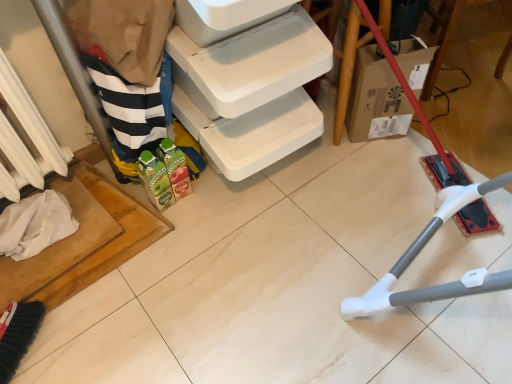
In order to face cardboard box at lower right, should I rotate leftwards or rightwards?

It's best to rotate right around 25.082 degrees.

What do you see at coordinates (29, 137) in the screenshot?
I see `white painted metal radiator at left` at bounding box center [29, 137].

The height and width of the screenshot is (384, 512). What are the coordinates of `cardboard box at lower right` in the screenshot? It's located at point(345,58).

Looking at this image, is cardboard box at lower right touching white painted metal radiator at left?

No, cardboard box at lower right is not in contact with white painted metal radiator at left.

Can you confirm if cardboard box at lower right is bigger than white painted metal radiator at left?

Yes.

From the image's perspective, would you say cardboard box at lower right is positioned over white painted metal radiator at left?

Yes, from the image's perspective, cardboard box at lower right is on top of white painted metal radiator at left.

Considering the sizes of objects cardboard box at lower right and white painted metal radiator at left in the image provided, who is wider, cardboard box at lower right or white painted metal radiator at left?

cardboard box at lower right is wider.

Who is smaller, white plastic shelf at lower left or white painted metal radiator at left?

With smaller size is white painted metal radiator at left.

Does white plastic shelf at lower left have a lesser width compared to white painted metal radiator at left?

No.

From a real-world perspective, is white plastic shelf at lower left physically below white painted metal radiator at left?

Yes, from a real-world perspective, white plastic shelf at lower left is under white painted metal radiator at left.

This screenshot has height=384, width=512. In the image, there is a cardboard box at lower right. What are the coordinates of `radiator below it (from the image's perspective)` in the screenshot? It's located at (29, 137).

Which of these two, white painted metal radiator at left or cardboard box at lower right, stands taller?

Standing taller between the two is white painted metal radiator at left.

Can you tell me how much white painted metal radiator at left and cardboard box at lower right differ in facing direction?

The facing directions of white painted metal radiator at left and cardboard box at lower right are 1.82 degrees apart.

Is white painted metal radiator at left at the left side of cardboard box at lower right?

Correct, you'll find white painted metal radiator at left to the left of cardboard box at lower right.

Identify the location of shelf that appears above the cardboard box at lower right (from a real-world perspective). The height and width of the screenshot is (384, 512). (250, 91).

Can you confirm if cardboard box at lower right is thinner than white plastic shelf at lower left?

Yes, cardboard box at lower right is thinner than white plastic shelf at lower left.

Is point (388, 3) positioned behind point (188, 113)?

That is True.

Which of these two, cardboard box at lower right or white plastic shelf at lower left, is bigger?

white plastic shelf at lower left.

From the image's perspective, who appears lower, white painted metal radiator at left or white plastic shelf at lower left?

white painted metal radiator at left is shown below in the image.

Consider the image. Which is more to the right, white painted metal radiator at left or white plastic shelf at lower left?

Positioned to the right is white plastic shelf at lower left.

Considering the positions of points (31, 104) and (312, 107), is point (31, 104) farther from camera compared to point (312, 107)?

No, (31, 104) is closer to viewer.

In terms of height, does white plastic shelf at lower left look taller or shorter compared to cardboard box at lower right?

white plastic shelf at lower left is taller than cardboard box at lower right.

Based on the photo, is white plastic shelf at lower left wider than cardboard box at lower right?

Indeed, white plastic shelf at lower left has a greater width compared to cardboard box at lower right.

Is white plastic shelf at lower left looking in the opposite direction of cardboard box at lower right?

white plastic shelf at lower left does not have its back to cardboard box at lower right.

Considering the positions of point (257, 114) and point (346, 32), is point (257, 114) closer or farther from the camera than point (346, 32)?

Clearly, point (257, 114) is closer to the camera than point (346, 32).

The height and width of the screenshot is (384, 512). I want to click on radiator located on the left of cardboard box at lower right, so click(x=29, y=137).

The image size is (512, 384). In the image, there is a white painted metal radiator at left. Identify the location of shelf below it (from a real-world perspective). (250, 91).

Looking at the image, which one is located closer to white painted metal radiator at left, white plastic shelf at lower left or cardboard box at lower right?

Based on the image, white plastic shelf at lower left appears to be nearer to white painted metal radiator at left.

Based on their spatial positions, is white painted metal radiator at left or cardboard box at lower right closer to white plastic shelf at lower left?

cardboard box at lower right is closer to white plastic shelf at lower left.

Looking at this image, looking at the image, which one is located further to cardboard box at lower right, white plastic shelf at lower left or white painted metal radiator at left?

white painted metal radiator at left is positioned further to the anchor cardboard box at lower right.

From the image, which object appears to be nearer to white plastic shelf at lower left, cardboard box at lower right or white painted metal radiator at left?

Among the two, cardboard box at lower right is located nearer to white plastic shelf at lower left.

When comparing their distances from white painted metal radiator at left, does cardboard box at lower right or white plastic shelf at lower left seem further?

cardboard box at lower right is positioned further to the anchor white painted metal radiator at left.

From the image, which object appears to be farther from cardboard box at lower right, white painted metal radiator at left or white plastic shelf at lower left?

Based on the image, white painted metal radiator at left appears to be further to cardboard box at lower right.

Image resolution: width=512 pixels, height=384 pixels. What are the coordinates of `shelf between white painted metal radiator at left and cardboard box at lower right from left to right` in the screenshot? It's located at (250, 91).